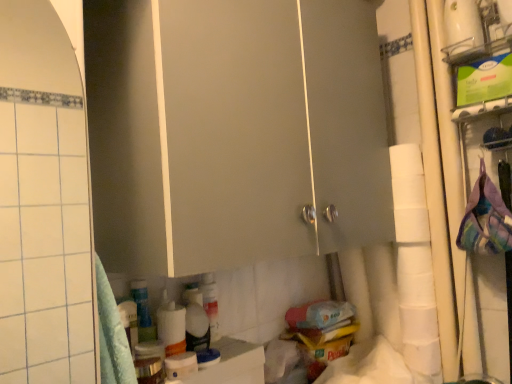
In order to click on matte white cabinet at center in this screenshot , I will do `click(234, 131)`.

Image resolution: width=512 pixels, height=384 pixels. Describe the element at coordinates (234, 131) in the screenshot. I see `matte white cabinet at center` at that location.

What do you see at coordinates (414, 262) in the screenshot?
I see `white matte toilet paper at right` at bounding box center [414, 262].

Identify the location of white matte toilet paper at right. Image resolution: width=512 pixels, height=384 pixels. (414, 262).

Where is `matte white cabinet at center`? The image size is (512, 384). matte white cabinet at center is located at coordinates (234, 131).

In the scene shown: In the image, is white matte toilet paper at right on the left side or the right side of matte white cabinet at center?

white matte toilet paper at right is positioned on matte white cabinet at center's right side.

Which object is more forward, white matte toilet paper at right or matte white cabinet at center?

matte white cabinet at center is closer to the camera.

Does point (423, 303) appear closer or farther from the camera than point (146, 212)?

Point (423, 303).

From the image's perspective, is white matte toilet paper at right positioned above or below matte white cabinet at center?

white matte toilet paper at right is situated lower than matte white cabinet at center in the image.

From a real-world perspective, which object stands above the other?

In real-world perspective, matte white cabinet at center is above.

Considering the sizes of white matte toilet paper at right and matte white cabinet at center in the image, is white matte toilet paper at right wider or thinner than matte white cabinet at center?

Clearly, white matte toilet paper at right has less width compared to matte white cabinet at center.

Consider the image. Considering the sizes of objects white matte toilet paper at right and matte white cabinet at center in the image provided, who is taller, white matte toilet paper at right or matte white cabinet at center?

white matte toilet paper at right is taller.

Based on their sizes in the image, would you say white matte toilet paper at right is bigger or smaller than matte white cabinet at center?

Clearly, white matte toilet paper at right is smaller in size than matte white cabinet at center.

Is white matte toilet paper at right situated inside matte white cabinet at center or outside?

white matte toilet paper at right is outside matte white cabinet at center.

Consider the image. Is white matte toilet paper at right placed right next to matte white cabinet at center?

No.

Is white matte toilet paper at right aimed at matte white cabinet at center?

No.

How much distance is there between white matte toilet paper at right and matte white cabinet at center?

The distance of white matte toilet paper at right from matte white cabinet at center is 20.48 inches.

This screenshot has width=512, height=384. I want to click on toilet paper lying below the matte white cabinet at center (from the image's perspective), so click(414, 262).

Consider the image. Considering the positions of objects matte white cabinet at center and white matte toilet paper at right in the image provided, who is more to the left, matte white cabinet at center or white matte toilet paper at right?

matte white cabinet at center.

Looking at this image, between matte white cabinet at center and white matte toilet paper at right, which one is positioned in front?

matte white cabinet at center is in front.

Is point (223, 201) in front of point (404, 190)?

Yes, it is in front of point (404, 190).

From the image's perspective, would you say matte white cabinet at center is shown under white matte toilet paper at right?

No.

From a real-world perspective, between matte white cabinet at center and white matte toilet paper at right, who is vertically higher?

matte white cabinet at center, from a real-world perspective.

Is matte white cabinet at center thinner than white matte toilet paper at right?

No.

Between matte white cabinet at center and white matte toilet paper at right, which one has less height?

matte white cabinet at center.

Considering the sizes of matte white cabinet at center and white matte toilet paper at right in the image, is matte white cabinet at center bigger or smaller than white matte toilet paper at right?

Clearly, matte white cabinet at center is larger in size than white matte toilet paper at right.

Is matte white cabinet at center inside or outside of white matte toilet paper at right?

matte white cabinet at center exists outside the volume of white matte toilet paper at right.

Are matte white cabinet at center and white matte toilet paper at right far apart?

Actually, matte white cabinet at center and white matte toilet paper at right are a little close together.

Is matte white cabinet at center oriented away from white matte toilet paper at right?

No.

What's the angular difference between matte white cabinet at center and white matte toilet paper at right's facing directions?

91 degrees separate the facing orientations of matte white cabinet at center and white matte toilet paper at right.

At what (x,y) coordinates should I click in order to perform the action: click on toilet paper below the matte white cabinet at center (from the image's perspective). Please return your answer as a coordinate pair (x, y). This screenshot has width=512, height=384. Looking at the image, I should click on point(414,262).

In the image, there is a matte white cabinet at center. Find the location of `toilet paper below it (from the image's perspective)`. toilet paper below it (from the image's perspective) is located at coordinates (414, 262).

Locate an element on the screen. This screenshot has width=512, height=384. toilet paper behind the matte white cabinet at center is located at coordinates (414, 262).